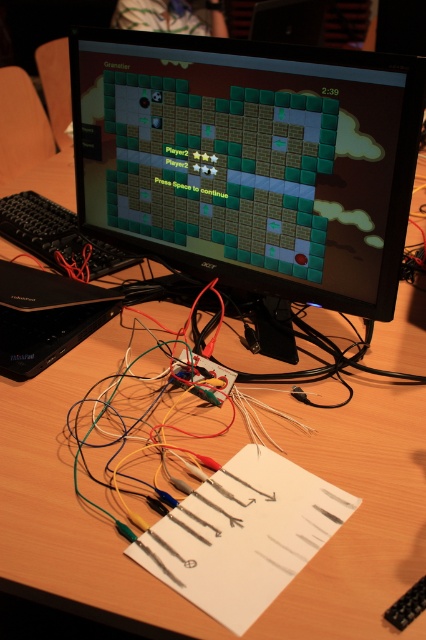
Question: Which object is farther from the camera taking this photo?

Choices:
 (A) black plastic keyboard at left
 (B) black plastic laptop at center
 (C) black plastic monitor at center

Answer: (A)

Question: Can you confirm if black plastic monitor at center is positioned to the left of black plastic laptop at center?

Choices:
 (A) yes
 (B) no

Answer: (B)

Question: Which object appears farthest from the camera in this image?

Choices:
 (A) black plastic keyboard at left
 (B) black plastic laptop at center

Answer: (A)

Question: Which point is closer to the camera?

Choices:
 (A) black plastic keyboard at left
 (B) black plastic laptop at center

Answer: (B)

Question: Considering the relative positions of black plastic monitor at center and black plastic laptop at center in the image provided, where is black plastic monitor at center located with respect to black plastic laptop at center?

Choices:
 (A) right
 (B) left

Answer: (A)

Question: Can you confirm if black plastic monitor at center is smaller than black plastic laptop at center?

Choices:
 (A) no
 (B) yes

Answer: (A)